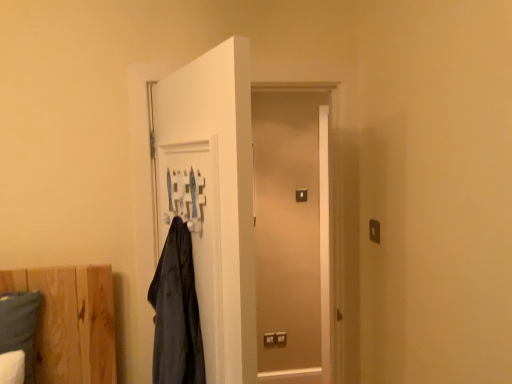
The height and width of the screenshot is (384, 512). What do you see at coordinates (256, 215) in the screenshot? I see `white glossy door at center` at bounding box center [256, 215].

You are a GUI agent. You are given a task and a screenshot of the screen. Output one action in this format:
    pyautogui.click(x=<x>, y=<y>)
    Task: Click on the white glossy door at center
    This screenshot has height=384, width=512.
    Given the screenshot: What is the action you would take?
    pyautogui.click(x=256, y=215)

Find the location of a particular element. white glossy door at center is located at coordinates (256, 215).